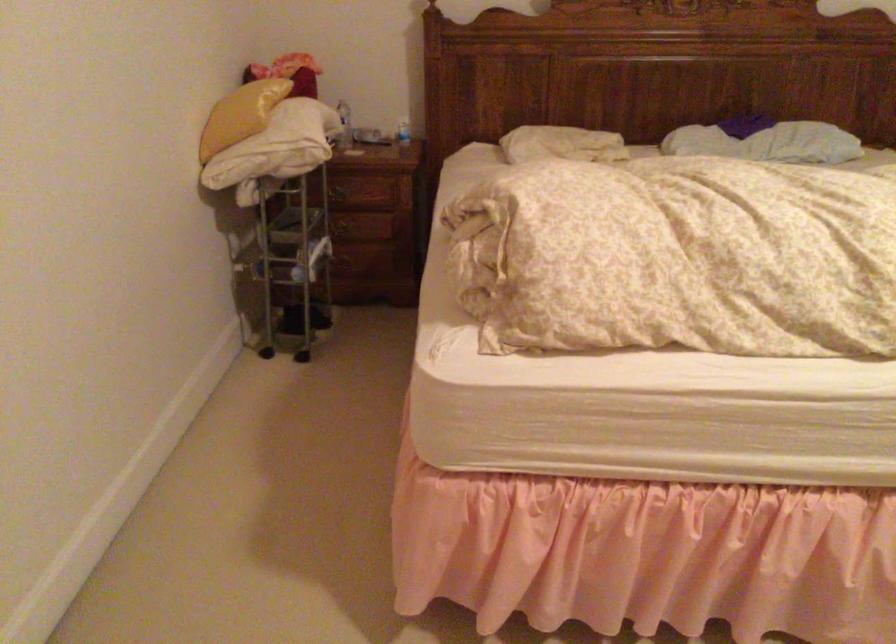
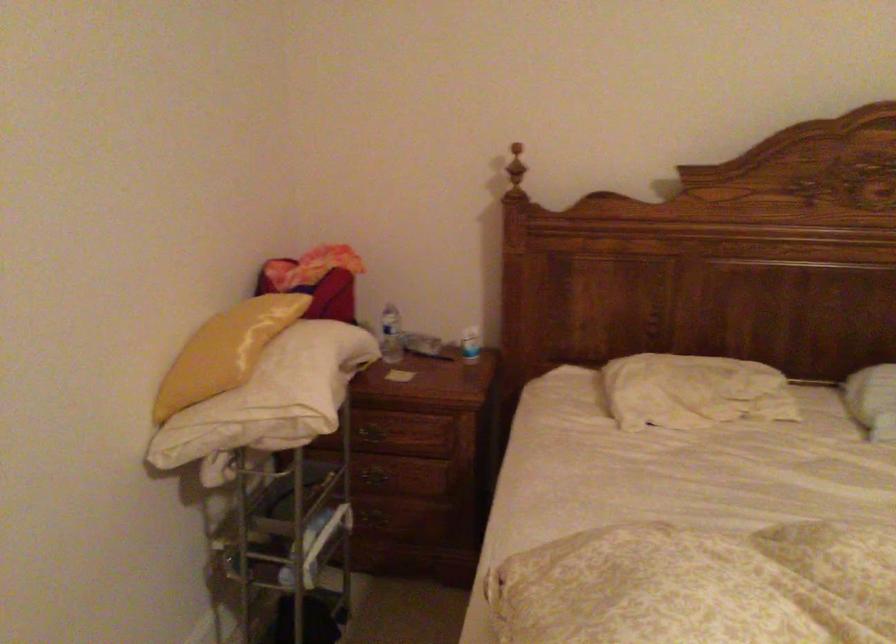
In the second image, find the point that corresponds to point (348, 122) in the first image.

(391, 335)